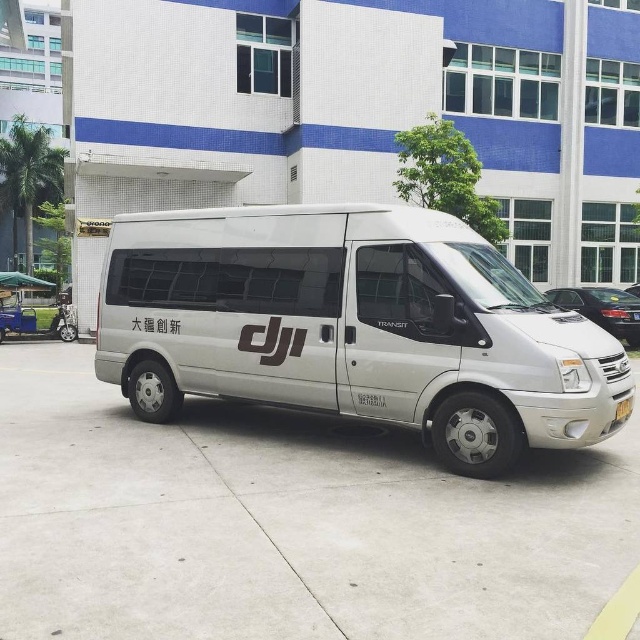
You are a delivery driver who needs to park your van on the white concrete pavement at center. However, there is a yellow rubber curb at lower right nearby. Considering their sizes, which area would provide more space for parking your van?

The white concrete pavement at center has a larger size compared to the yellow rubber curb at lower right, so parking on the white concrete pavement at center would provide more space for your van.